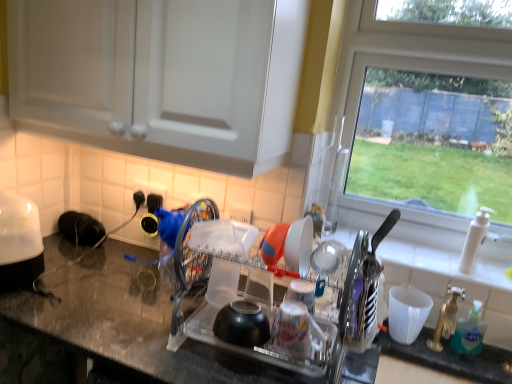
The height and width of the screenshot is (384, 512). Identify the location of vacant region to the left of blue translucent soap dispenser at right. (414, 340).